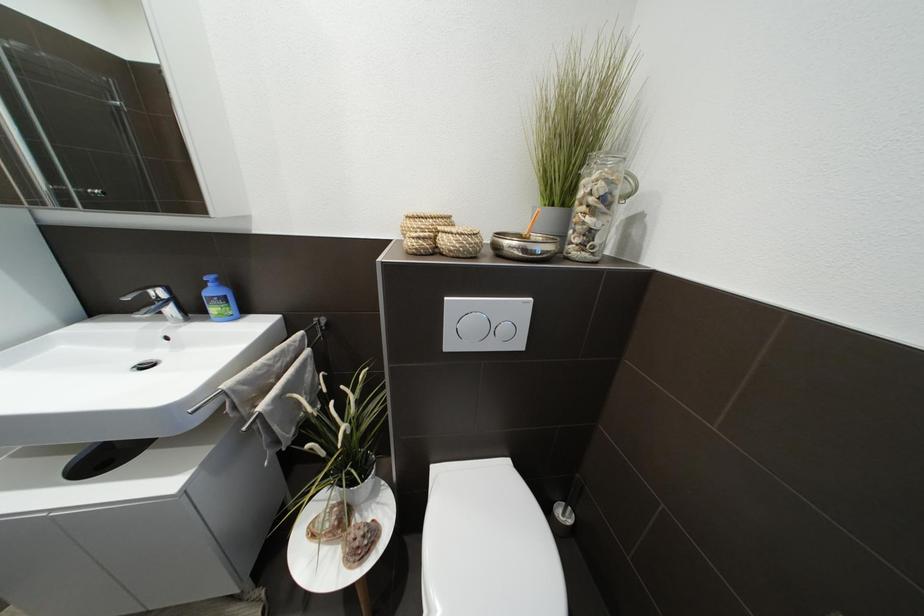
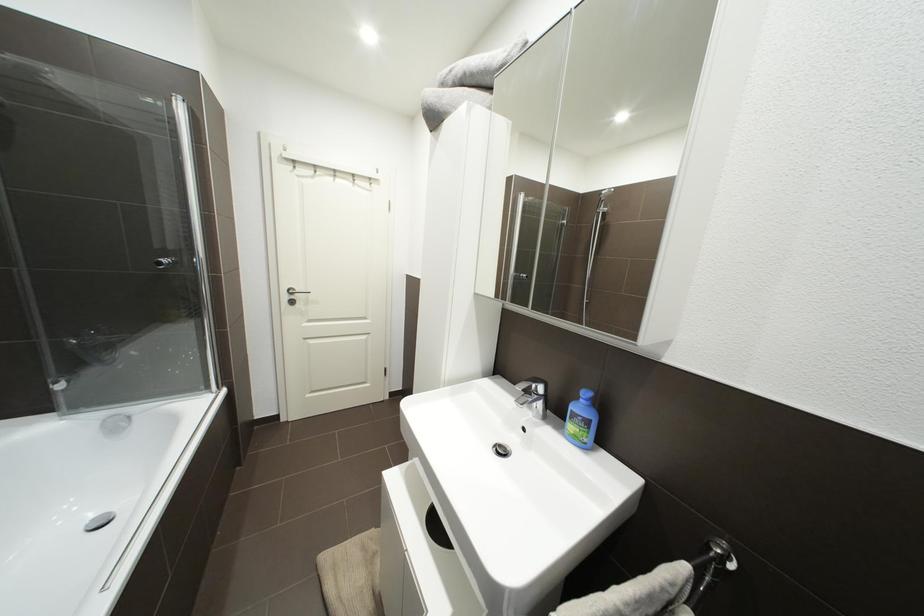
Question: The first image is from the beginning of the video and the second image is from the end. How did the camera likely rotate when shooting the video?

Choices:
 (A) Left
 (B) Right
 (C) Up
 (D) Down

Answer: (A)